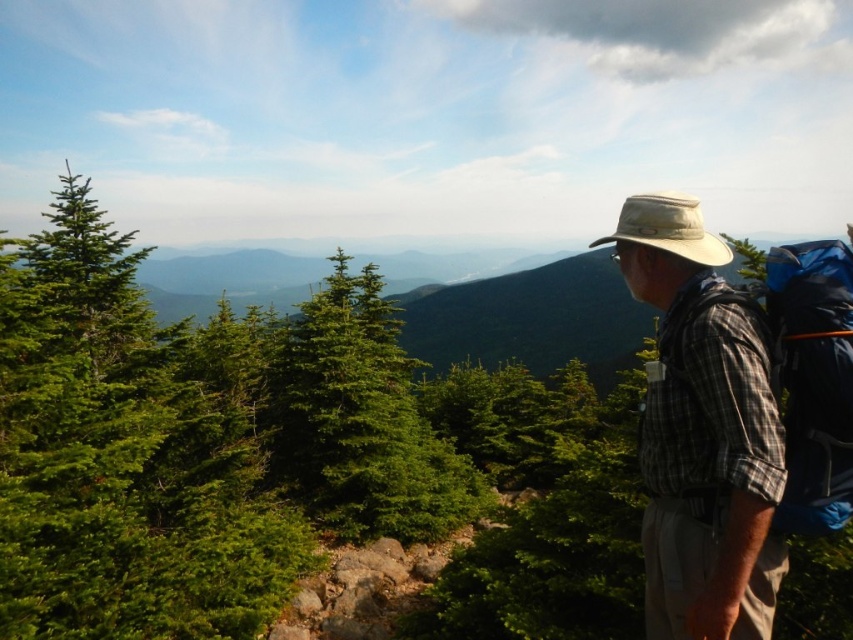
Question: Can you confirm if blue fabric backpack at right is positioned to the right of tan canvas hat at upper right?

Choices:
 (A) yes
 (B) no

Answer: (B)

Question: Which of the following is the farthest from the observer?

Choices:
 (A) tan canvas hat at upper right
 (B) green matte tree at left
 (C) blue fabric backpack at right

Answer: (B)

Question: Where is green matte tree at left located in relation to blue fabric backpack at right in the image?

Choices:
 (A) above
 (B) below

Answer: (B)

Question: Does green matte tree at left appear over plaid fabric shirt at right?

Choices:
 (A) yes
 (B) no

Answer: (B)

Question: Which of the following is the farthest from the observer?

Choices:
 (A) plaid fabric shirt at right
 (B) green matte tree at left

Answer: (B)

Question: Which point is closer to the camera taking this photo?

Choices:
 (A) (74, 524)
 (B) (682, 241)

Answer: (B)